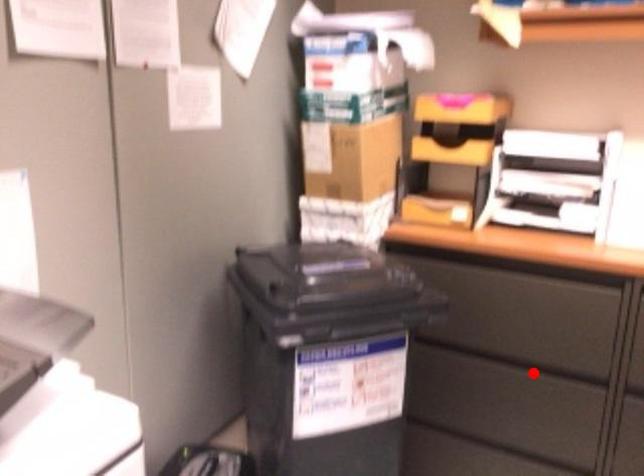
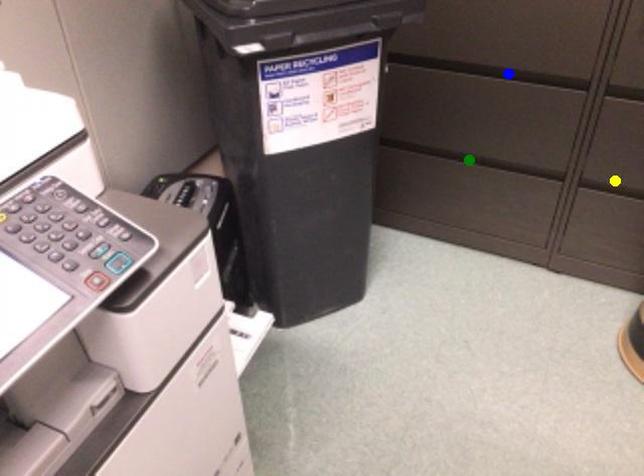
Question: I am providing you with two images of the same scene from different viewpoints. A red point is marked on the first image. You are given multiple points on the second image. In image 2, which mark is for the same physical point as the one in image 1?

Choices:
 (A) yellow point
 (B) blue point
 (C) green point

Answer: (B)